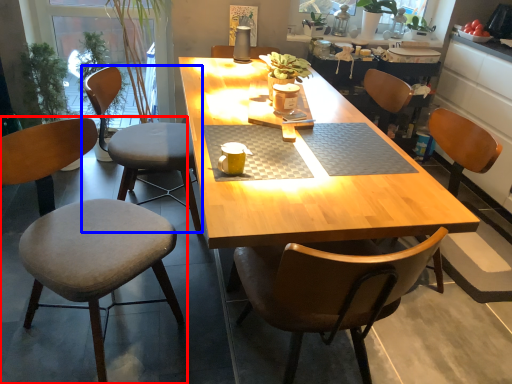
Question: Which object is closer to the camera taking this photo, chair (highlighted by a red box) or chair (highlighted by a blue box)?

Choices:
 (A) chair
 (B) chair

Answer: (A)